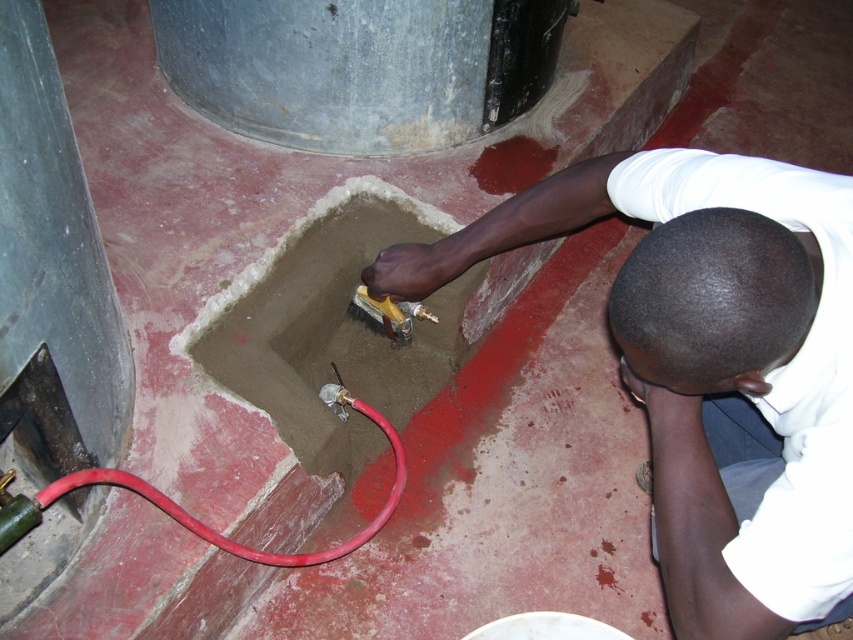
Question: Does red rubber hose at lower left appear under metallic gold spray gun at center?

Choices:
 (A) no
 (B) yes

Answer: (B)

Question: Which point is closer to the camera taking this photo?

Choices:
 (A) (393, 328)
 (B) (381, 381)

Answer: (A)

Question: Which is nearer to the smooth concrete hole at center?

Choices:
 (A) metallic gold spray gun at center
 (B) smooth concrete basin at center

Answer: (A)

Question: Can you confirm if smooth concrete hole at center is bigger than red rubber hose at lower left?

Choices:
 (A) no
 (B) yes

Answer: (B)

Question: Which of the following is the closest to the observer?

Choices:
 (A) smooth concrete basin at center
 (B) smooth concrete hole at center
 (C) red rubber hose at lower left

Answer: (A)

Question: Does smooth concrete basin at center lie in front of red rubber hose at lower left?

Choices:
 (A) yes
 (B) no

Answer: (A)